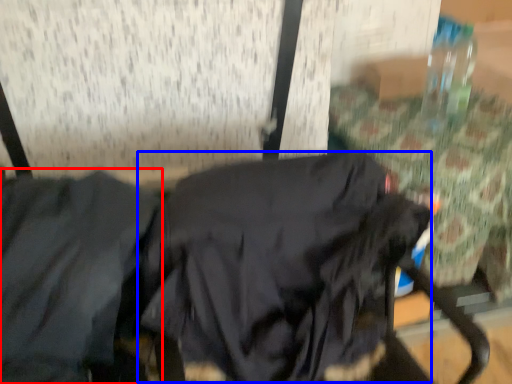
Question: Which object is closer to the camera taking this photo, jacket (highlighted by a red box) or sweatshirt (highlighted by a blue box)?

Choices:
 (A) jacket
 (B) sweatshirt

Answer: (A)